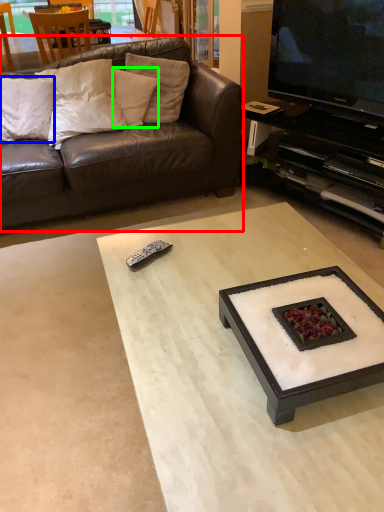
Question: Which is nearer to the studio couch (highlighted by a red box)? pillow (highlighted by a blue box) or pillow (highlighted by a green box).

Choices:
 (A) pillow
 (B) pillow

Answer: (B)